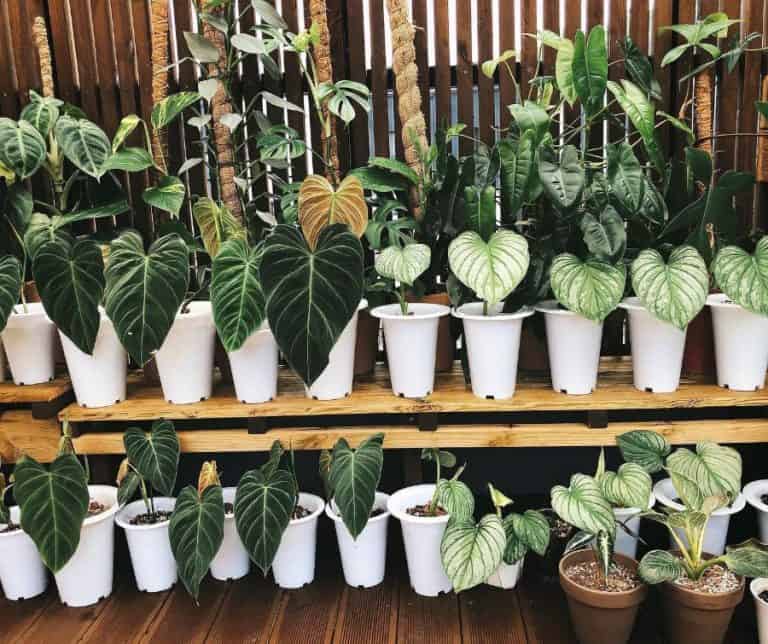
You are a GUI agent. You are given a task and a screenshot of the screen. Output one action in this format:
    pyautogui.click(x=<x>, y=<y>)
    Task: Click on the pot
    
    Given the screenshot: What is the action you would take?
    pyautogui.click(x=85, y=581)